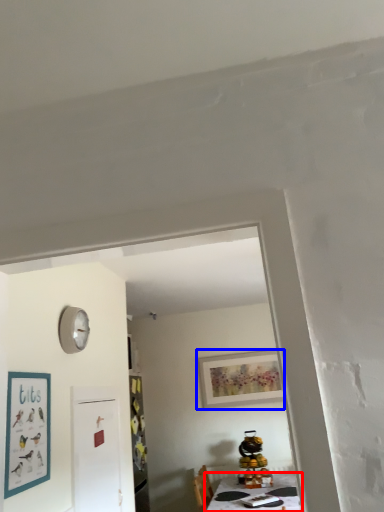
Question: Which point is closer to the camera, table (highlighted by a red box) or picture frame (highlighted by a blue box)?

Choices:
 (A) table
 (B) picture frame

Answer: (A)